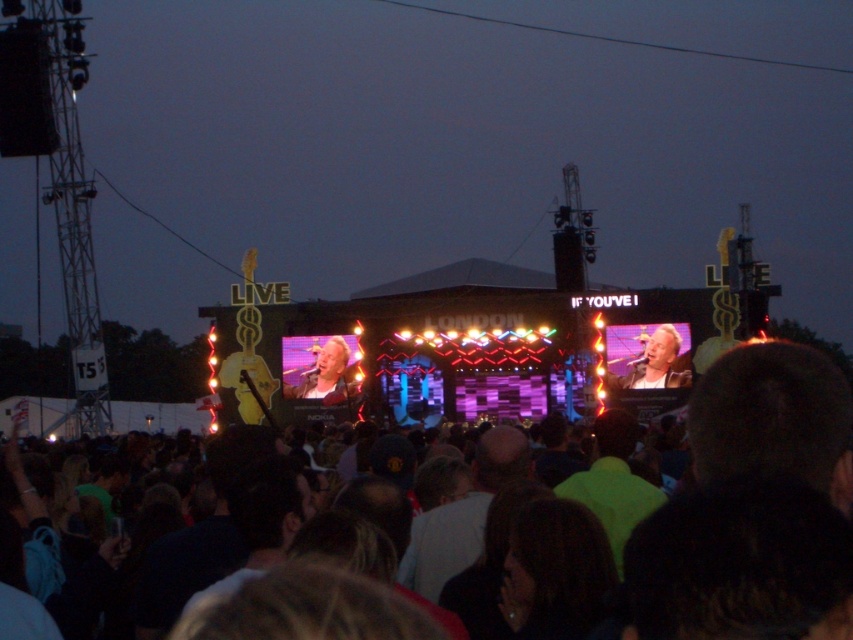
Can you confirm if dark hair at center is taller than matte black jacket at center?

Yes, dark hair at center is taller than matte black jacket at center.

Is dark hair at center wider than matte black jacket at center?

Correct, the width of dark hair at center exceeds that of matte black jacket at center.

Locate an element on the screen. The width and height of the screenshot is (853, 640). dark hair at center is located at coordinates (770, 417).

Find the location of `dark hair at center`. dark hair at center is located at coordinates (770, 417).

Who is positioned more to the right, matte black jacket at center or light brown leather jacket at center?

From the viewer's perspective, matte black jacket at center appears more on the right side.

Can you confirm if matte black jacket at center is positioned to the right of light brown leather jacket at center?

Correct, you'll find matte black jacket at center to the right of light brown leather jacket at center.

Does point (656, 376) come behind point (352, 342)?

No, (656, 376) is closer to viewer.

Where is `matte black jacket at center`? This screenshot has height=640, width=853. matte black jacket at center is located at coordinates (647, 356).

Does point (733, 349) lie behind point (335, 376)?

No, (733, 349) is in front of (335, 376).

The width and height of the screenshot is (853, 640). In order to click on dark hair at center in this screenshot , I will do `click(770, 417)`.